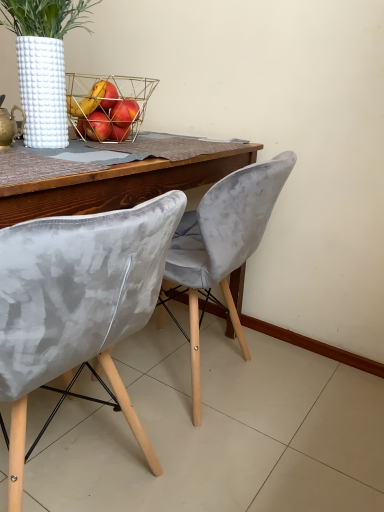
Question: Is velvet grey chair at center, marked as the 2th chair in a front-to-back arrangement, facing away from velvet grey chair at center, placed as the 2th chair when sorted from back to front?

Choices:
 (A) no
 (B) yes

Answer: (A)

Question: Considering the relative positions of velvet grey chair at center, which is the 1th chair in back-to-front order, and velvet grey chair at center, the first chair from the front, in the image provided, is velvet grey chair at center, which is the 1th chair in back-to-front order, to the left of velvet grey chair at center, the first chair from the front, from the viewer's perspective?

Choices:
 (A) no
 (B) yes

Answer: (A)

Question: Does velvet grey chair at center, marked as the 2th chair in a front-to-back arrangement, have a lesser width compared to velvet grey chair at center, the first chair from the front?

Choices:
 (A) yes
 (B) no

Answer: (A)

Question: Is velvet grey chair at center, placed as the 2th chair when sorted from back to front, completely or partially inside velvet grey chair at center, marked as the 2th chair in a front-to-back arrangement?

Choices:
 (A) yes
 (B) no

Answer: (B)

Question: Is velvet grey chair at center, marked as the 2th chair in a front-to-back arrangement, wider than velvet grey chair at center, placed as the 2th chair when sorted from back to front?

Choices:
 (A) yes
 (B) no

Answer: (B)

Question: In terms of width, does white textured vase at upper left look wider or thinner when compared to velvet grey chair at center, which is the 1th chair in back-to-front order?

Choices:
 (A) wide
 (B) thin

Answer: (B)

Question: In terms of height, does white textured vase at upper left look taller or shorter compared to velvet grey chair at center, which is the 1th chair in back-to-front order?

Choices:
 (A) short
 (B) tall

Answer: (A)

Question: Relative to velvet grey chair at center, which is the 1th chair in back-to-front order, is white textured vase at upper left in front or behind?

Choices:
 (A) behind
 (B) front

Answer: (B)

Question: Is white textured vase at upper left situated inside velvet grey chair at center, which is the 1th chair in back-to-front order, or outside?

Choices:
 (A) outside
 (B) inside

Answer: (A)

Question: From a real-world perspective, is velvet grey chair at center, placed as the 2th chair when sorted from back to front, positioned above or below gold metallic teapot at upper left?

Choices:
 (A) below
 (B) above

Answer: (A)

Question: Based on their positions, is velvet grey chair at center, the first chair from the front, located to the left or right of gold metallic teapot at upper left?

Choices:
 (A) right
 (B) left

Answer: (A)

Question: Which is correct: velvet grey chair at center, placed as the 2th chair when sorted from back to front, is inside gold metallic teapot at upper left, or outside of it?

Choices:
 (A) outside
 (B) inside

Answer: (A)

Question: From the image's perspective, is velvet grey chair at center, placed as the 2th chair when sorted from back to front, positioned above or below gold metallic teapot at upper left?

Choices:
 (A) above
 (B) below

Answer: (B)

Question: Is gold wire basket at center in front of or behind velvet grey chair at center, placed as the 2th chair when sorted from back to front, in the image?

Choices:
 (A) front
 (B) behind

Answer: (B)

Question: Is gold wire basket at center inside or outside of velvet grey chair at center, placed as the 2th chair when sorted from back to front?

Choices:
 (A) outside
 (B) inside

Answer: (A)